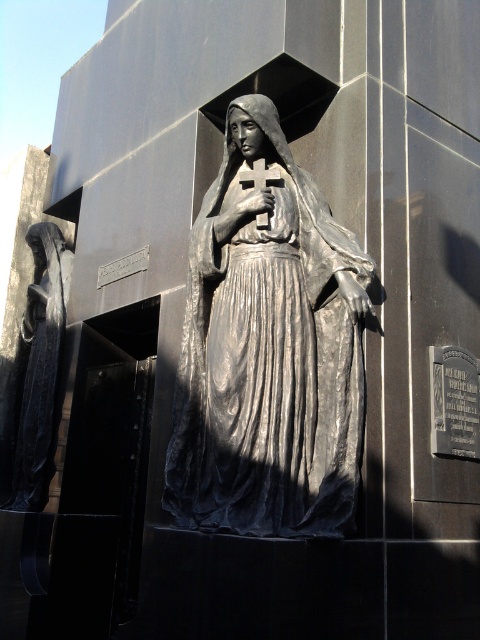
You are an art conservator assessing the placement of the polished bronze statue at center and the polished bronze robe at left. Which object would require a taller display stand to accommodate its height?

The polished bronze statue at center is taller than the polished bronze robe at left, so it would require a taller display stand to accommodate its height.